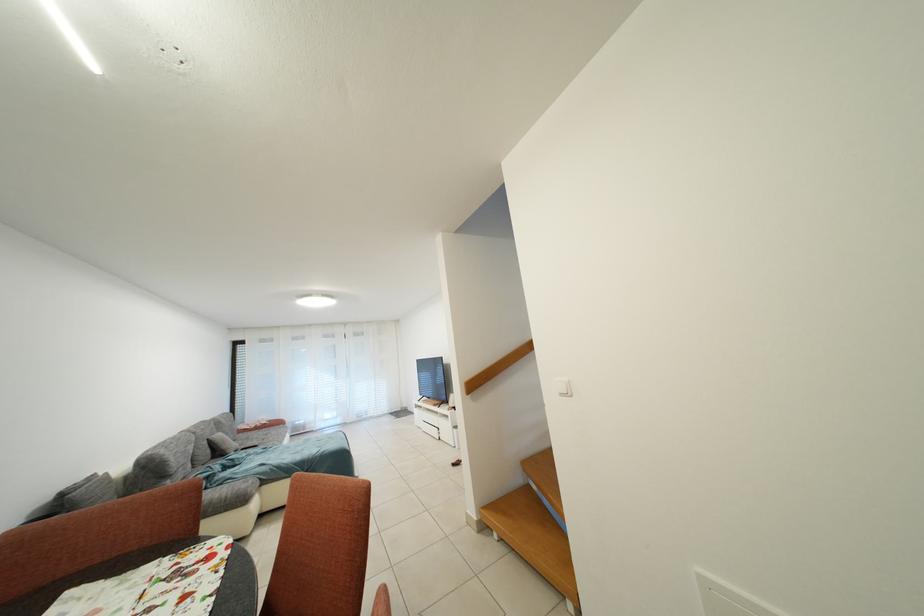
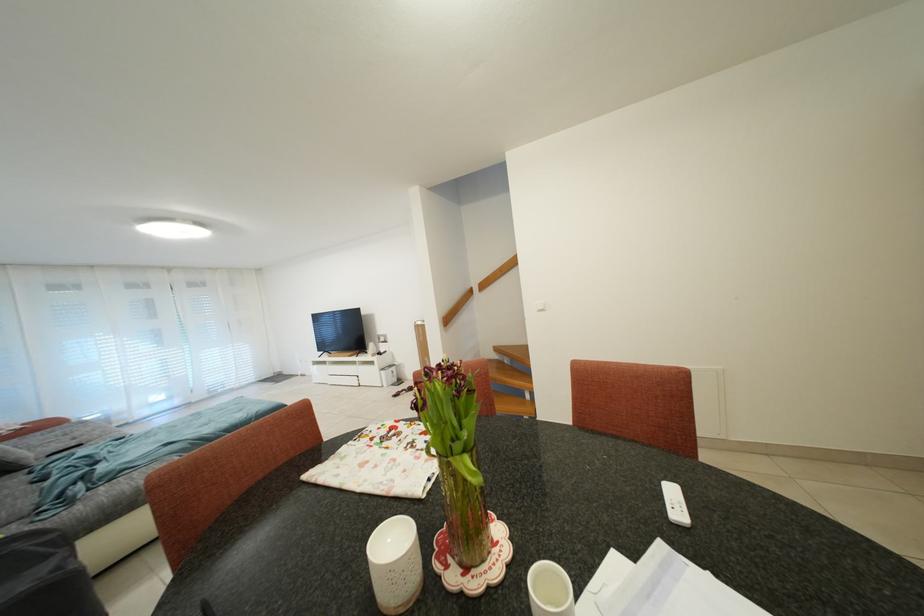
Where in the second image is the point corresponding to [233,451] from the first image?

(19, 462)